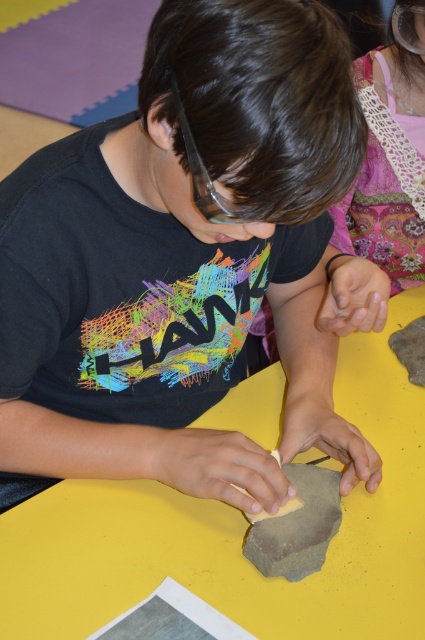
Question: Based on their relative distances, which object is nearer to the clear plastic goggles at upper center?

Choices:
 (A) patterned fabric bag at upper right
 (B) clear plastic goggles at center

Answer: (A)

Question: Does gray rough stone at center have a smaller size compared to clear plastic goggles at upper center?

Choices:
 (A) no
 (B) yes

Answer: (A)

Question: Can you confirm if matte black shirt at center is positioned above clear plastic goggles at center?

Choices:
 (A) no
 (B) yes

Answer: (A)

Question: Does patterned fabric bag at upper right come behind clear plastic goggles at center?

Choices:
 (A) no
 (B) yes

Answer: (B)

Question: Which of these objects is positioned closest to the yellow matte table at center?

Choices:
 (A) gray rough stone at center
 (B) matte black shirt at center
 (C) clear plastic goggles at upper center

Answer: (A)

Question: Which object is the farthest from the matte black shirt at center?

Choices:
 (A) clear plastic goggles at center
 (B) clear plastic goggles at upper center
 (C) yellow matte table at center

Answer: (B)